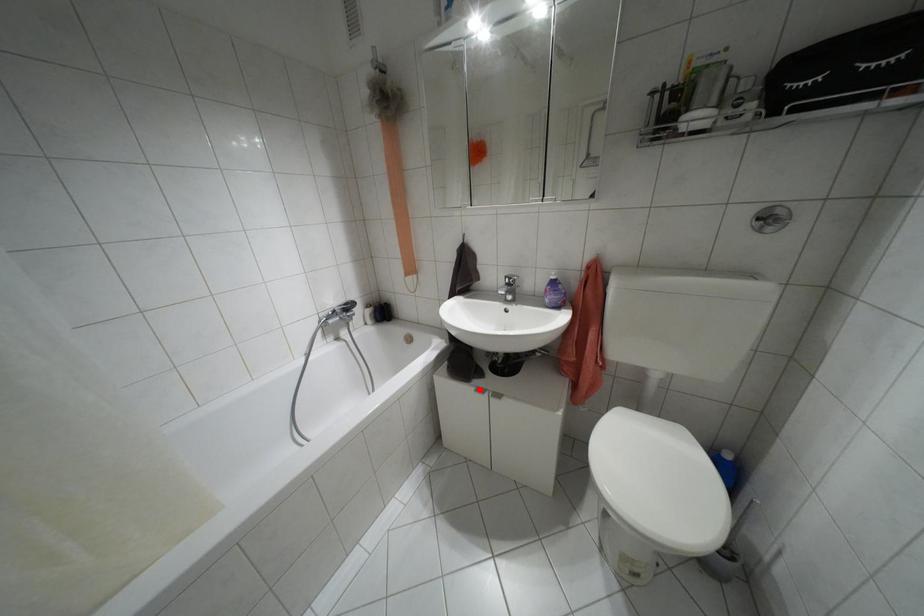
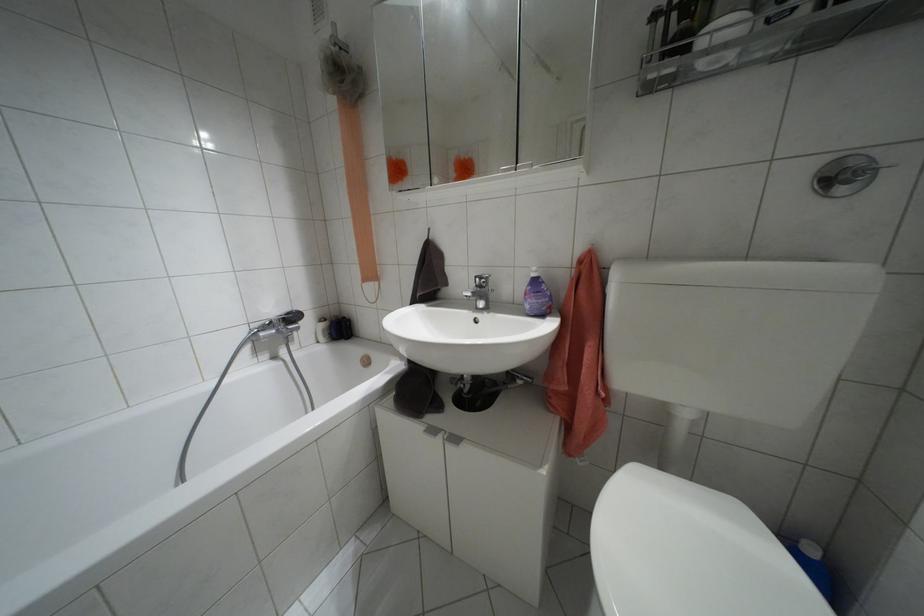
In the second image, find the point that corresponds to the highlighted location in the first image.

(432, 430)